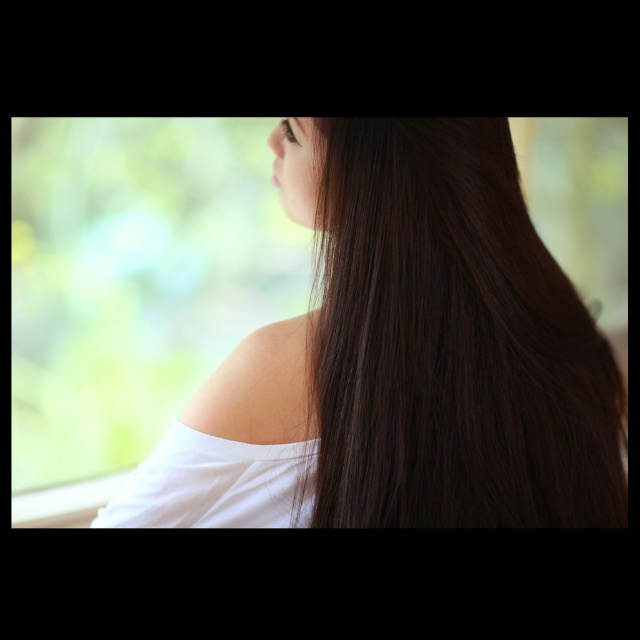
Question: Which point is closer to the camera?

Choices:
 (A) dark brown silky hair at center
 (B) white smooth shoulder at center

Answer: (A)

Question: Which of the following is the farthest from the observer?

Choices:
 (A) dark brown silky hair at center
 (B) white smooth shoulder at center

Answer: (B)

Question: Does dark brown silky hair at center appear over white smooth shoulder at center?

Choices:
 (A) no
 (B) yes

Answer: (B)

Question: Can you confirm if dark brown silky hair at center is bigger than white smooth shoulder at center?

Choices:
 (A) no
 (B) yes

Answer: (B)

Question: Among these objects, which one is nearest to the camera?

Choices:
 (A) dark brown silky hair at center
 (B) white smooth shoulder at center

Answer: (A)

Question: Is dark brown silky hair at center closer to camera compared to white smooth shoulder at center?

Choices:
 (A) yes
 (B) no

Answer: (A)